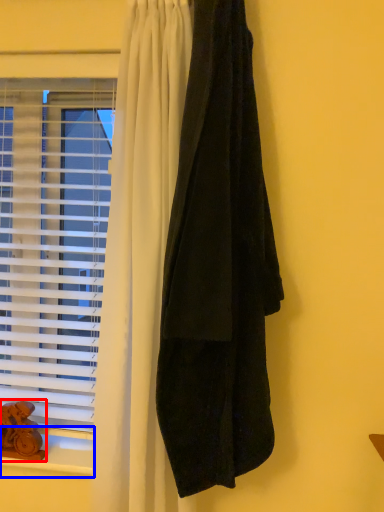
Question: Which object is closer to the camera taking this photo, animal (highlighted by a red box) or window sill (highlighted by a blue box)?

Choices:
 (A) animal
 (B) window sill

Answer: (B)